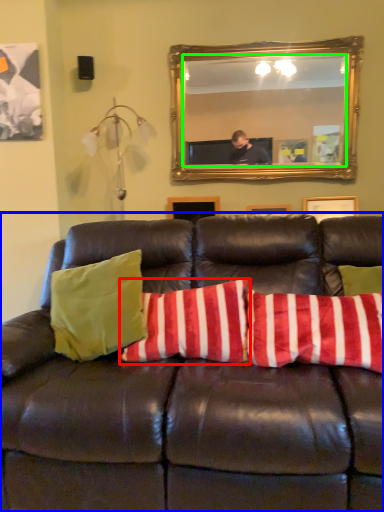
Question: Which object is positioned farthest from pillow (highlighted by a red box)? Select from studio couch (highlighted by a blue box) and mirror (highlighted by a green box).

Choices:
 (A) studio couch
 (B) mirror

Answer: (B)